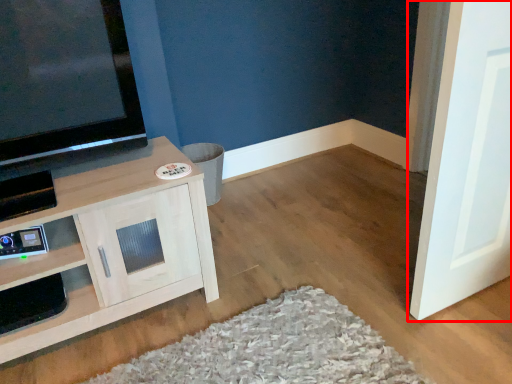
Question: Where is door (annotated by the red box) located in relation to cabinetry in the image?

Choices:
 (A) left
 (B) right

Answer: (B)